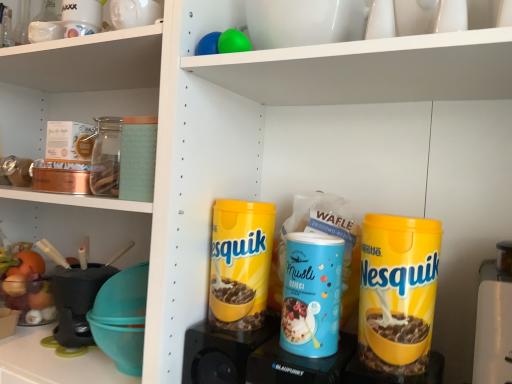
Question: From a real-world perspective, is yellow matte nesquik canister at center, which ranks as the 1th cereal in back-to-front order, physically located above or below yellow matte nesquik canister at center right, which ranks as the 2th cereal in back-to-front order?

Choices:
 (A) above
 (B) below

Answer: (A)

Question: Is point (254, 213) positioned closer to the camera than point (373, 347)?

Choices:
 (A) closer
 (B) farther

Answer: (B)

Question: Which object is the farthest from the blue plastic container at center, marked as the first appliance in a right-to-left arrangement?

Choices:
 (A) yellow matte nesquik canister at center, marked as the 2th cereal in a front-to-back arrangement
 (B) yellow matte nesquik canister at center right, marked as the 1th cereal in a right-to-left arrangement
 (C) yellow plastic speaker at lower center, the first appliance positioned from the left
 (D) blue matte musli at center

Answer: (B)

Question: Based on their relative distances, which object is nearer to the blue matte musli at center?

Choices:
 (A) yellow matte nesquik canister at center right, the first cereal viewed from the front
 (B) blue plastic container at center, marked as the first appliance in a right-to-left arrangement
 (C) yellow matte nesquik canister at center, the second cereal from the right
 (D) yellow plastic speaker at lower center, the 2th appliance from the right

Answer: (B)